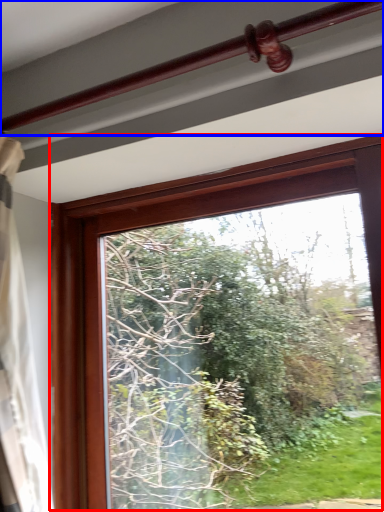
Question: Which object is further to the camera taking this photo, window (highlighted by a red box) or rail (highlighted by a blue box)?

Choices:
 (A) window
 (B) rail

Answer: (A)